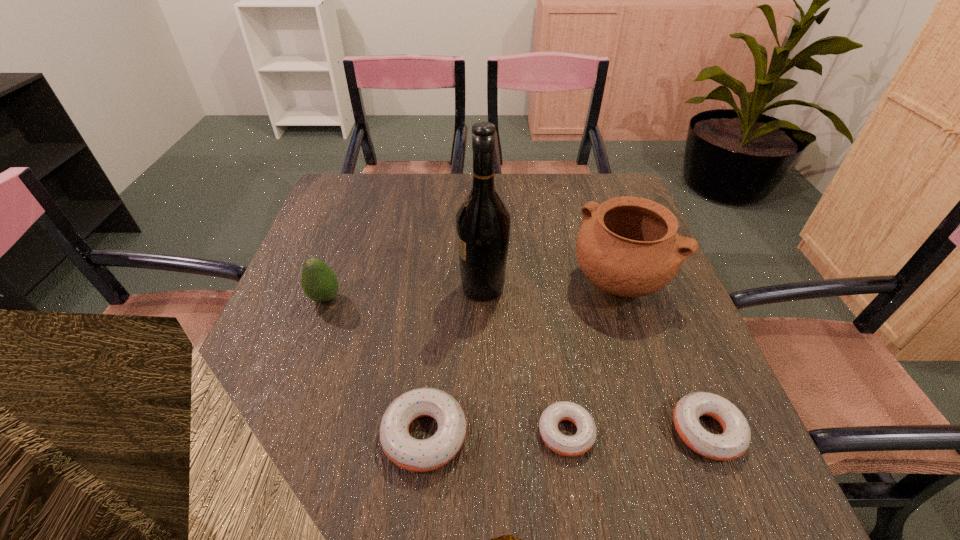
Identify the location of the leftmost doughnut. (415, 455).

Where is `the third shortest object`? the third shortest object is located at coordinates (415, 455).

Locate an element on the screen. the second doughnut from left to right is located at coordinates [570, 446].

Locate an element on the screen. The width and height of the screenshot is (960, 540). the shortest doughnut is located at coordinates pos(570,446).

The width and height of the screenshot is (960, 540). Find the location of `the rightmost doughnut`. the rightmost doughnut is located at coordinates (734, 441).

Image resolution: width=960 pixels, height=540 pixels. I want to click on the second shortest object, so click(734, 441).

Image resolution: width=960 pixels, height=540 pixels. In order to click on the tallest object in this screenshot , I will do `click(482, 222)`.

At what (x,y) coordinates should I click in order to perform the action: click on the fifth shortest object. Please return your answer as a coordinate pair (x, y). Looking at the image, I should click on (628, 246).

Locate an element on the screen. The height and width of the screenshot is (540, 960). the third tallest object is located at coordinates (319, 282).

Locate an element on the screen. The width and height of the screenshot is (960, 540). the leftmost object is located at coordinates (319, 282).